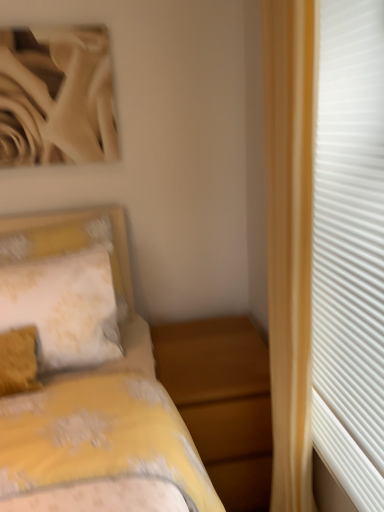
Question: Can you confirm if yellow floral fabric pillow at left is smaller than white textured curtain at right?

Choices:
 (A) no
 (B) yes

Answer: (B)

Question: Is yellow floral fabric pillow at left in contact with white textured curtain at right?

Choices:
 (A) no
 (B) yes

Answer: (A)

Question: Is yellow floral fabric pillow at left further to the viewer compared to white textured curtain at right?

Choices:
 (A) yes
 (B) no

Answer: (A)

Question: Considering the relative sizes of yellow floral fabric pillow at left and white textured curtain at right in the image provided, is yellow floral fabric pillow at left thinner than white textured curtain at right?

Choices:
 (A) yes
 (B) no

Answer: (B)

Question: From a real-world perspective, is yellow floral fabric pillow at left over white textured curtain at right?

Choices:
 (A) no
 (B) yes

Answer: (A)

Question: Is yellow floral fabric pillow at left turned away from white textured curtain at right?

Choices:
 (A) yes
 (B) no

Answer: (B)

Question: Does matte wood nightstand at lower center have a smaller size compared to yellow floral fabric pillow at left?

Choices:
 (A) yes
 (B) no

Answer: (B)

Question: Considering the relative sizes of matte wood nightstand at lower center and yellow floral fabric pillow at left in the image provided, is matte wood nightstand at lower center taller than yellow floral fabric pillow at left?

Choices:
 (A) yes
 (B) no

Answer: (A)

Question: Does matte wood nightstand at lower center have a larger size compared to yellow floral fabric pillow at left?

Choices:
 (A) yes
 (B) no

Answer: (A)

Question: Could you tell me if matte wood nightstand at lower center is facing yellow floral fabric pillow at left?

Choices:
 (A) yes
 (B) no

Answer: (B)

Question: Considering the relative sizes of matte wood nightstand at lower center and yellow floral fabric pillow at left in the image provided, is matte wood nightstand at lower center wider than yellow floral fabric pillow at left?

Choices:
 (A) no
 (B) yes

Answer: (B)

Question: Can we say matte wood nightstand at lower center lies outside yellow floral fabric pillow at left?

Choices:
 (A) no
 (B) yes

Answer: (B)

Question: Can you confirm if white textured curtain at right is shorter than yellow floral fabric pillow at left?

Choices:
 (A) no
 (B) yes

Answer: (A)